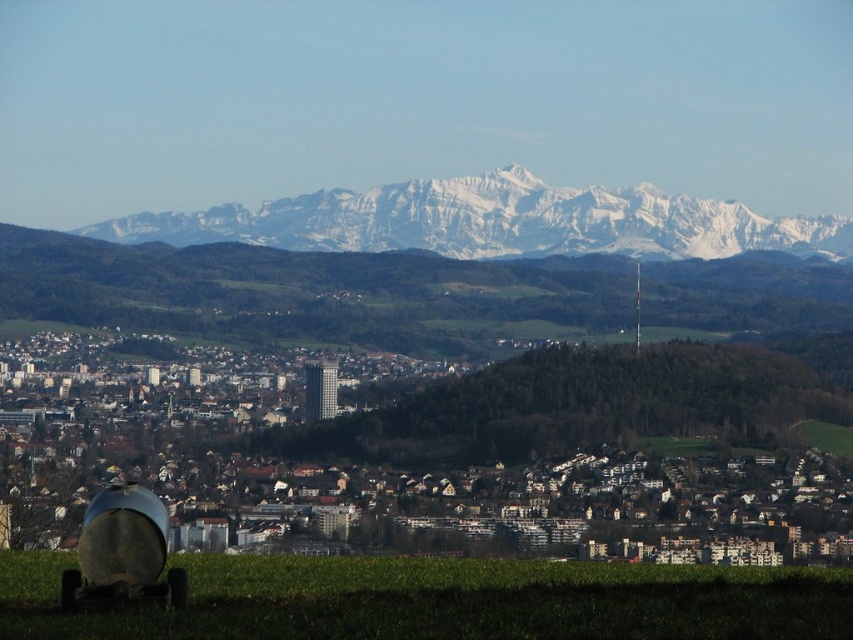
Consider the image. You are a drone operator trying to capture a photo of the city from above. You have two points marked on your screen, point 1 at coordinates point (428, 564) and point 2 at coordinates point (422, 202). Which point is closer to the camera lens so that you can focus on it first?

→ Point (422, 202) is closer to the camera lens than point (428, 564), so you should focus on point (422, 202) first.